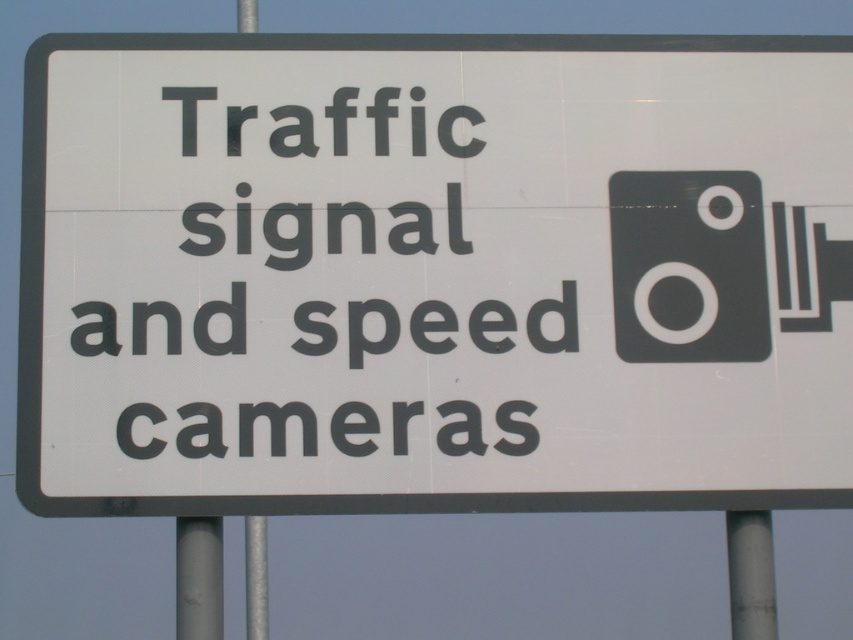
Question: Can you confirm if white plastic sign at center is smaller than black plastic text at center?

Choices:
 (A) yes
 (B) no

Answer: (B)

Question: Which of these objects is positioned farthest from the metallic gray pole at lower right?

Choices:
 (A) white plastic sign at center
 (B) black plastic text at center

Answer: (B)

Question: Can you confirm if white plastic sign at center is positioned to the left of black plastic text at center?

Choices:
 (A) no
 (B) yes

Answer: (A)

Question: Which point is closer to the camera?

Choices:
 (A) (775, 593)
 (B) (717, 234)
 (C) (134, 227)

Answer: (C)

Question: Does white plastic sign at center appear on the left side of metallic gray pole at lower right?

Choices:
 (A) yes
 (B) no

Answer: (A)

Question: Which of the following is the closest to the observer?

Choices:
 (A) white plastic sign at center
 (B) black plastic text at center
 (C) metallic gray pole at lower right

Answer: (A)